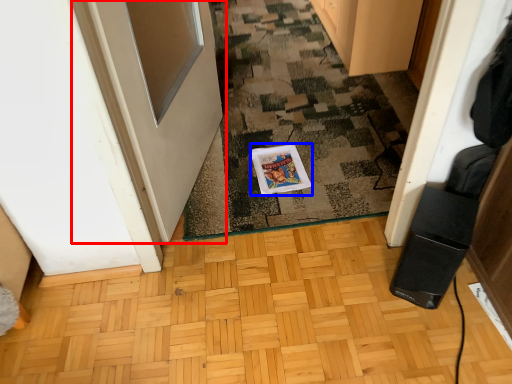
Question: Which object is closer to the camera taking this photo, door (highlighted by a red box) or postcard (highlighted by a blue box)?

Choices:
 (A) door
 (B) postcard

Answer: (A)